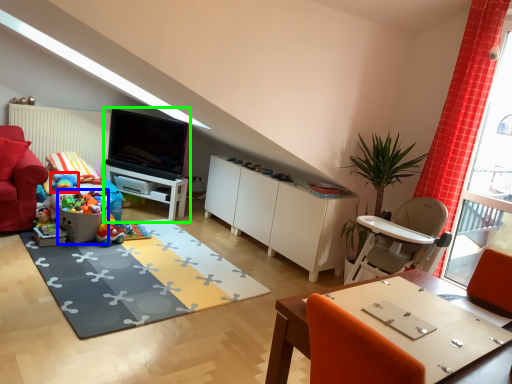
Question: Which is farther away from toy (highlighted by a red box)? toy (highlighted by a blue box) or entertainment center (highlighted by a green box)?

Choices:
 (A) toy
 (B) entertainment center

Answer: (B)